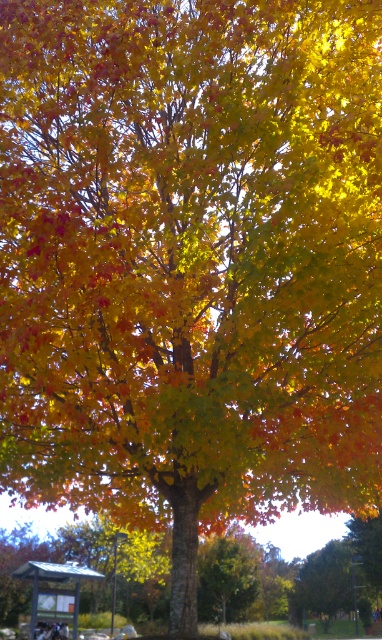
Measure the distance between shiny green leaf at center and camera.

shiny green leaf at center is 31.48 meters away from camera.

Who is more distant from viewer, (237, 600) or (37, 593)?

The point (237, 600) is behind.

Where is `shiny green leaf at center`? shiny green leaf at center is located at coordinates (228, 577).